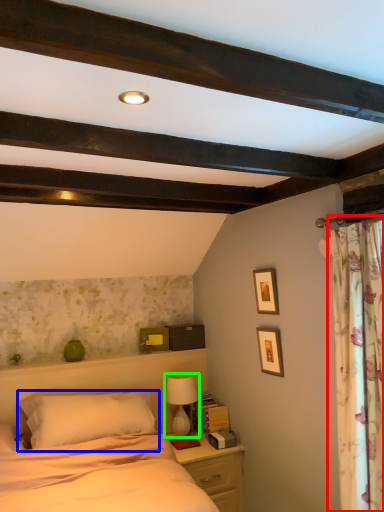
Question: Estimate the real-world distances between objects in this image. Which object is farther from curtain (highlighted by a red box), pillow (highlighted by a blue box) or table lamp (highlighted by a green box)?

Choices:
 (A) pillow
 (B) table lamp

Answer: (B)